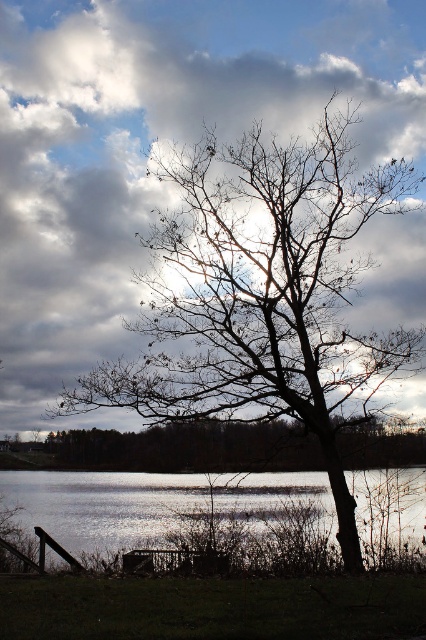
You are an artist sketching the lakeside scene. You notice the bare branches at center and the silvery reflective water at lower center. Which object appears narrower in your sketch?

The bare branches at center appears narrower than the silvery reflective water at lower center.

You are a photographer standing at the lakeside and want to capture a closeup shot of the bare branches at center. Given that your camera can focus on objects within 10 meters, will you be able to take the photo without moving closer?

The bare branches at center is 14.26 meters away from camera, which is beyond the camera focus range of 10 meters. Therefore, you cannot take the closeup shot without moving closer.